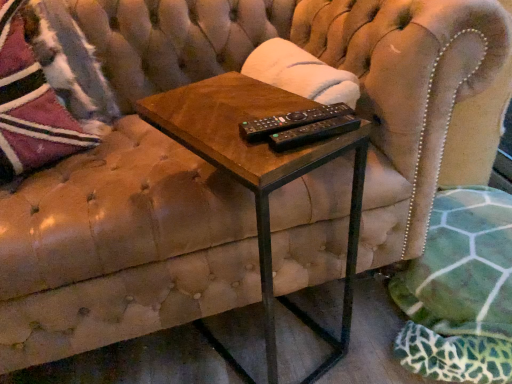
Question: Is black plastic remote controls at center in front of or behind black plastic remote at center in the image?

Choices:
 (A) front
 (B) behind

Answer: (B)

Question: From a real-world perspective, relative to black plastic remote at center, is black plastic remote controls at center vertically above or below?

Choices:
 (A) below
 (B) above

Answer: (A)

Question: Which is nearer to the black plastic remote at center?

Choices:
 (A) green fabric swivel chair at lower right
 (B) black plastic remote controls at center
 (C) velvet textured throw pillow at upper left
 (D) woodenmaterial/texturetable at center

Answer: (B)

Question: Which object is positioned farthest from the velvet textured throw pillow at upper left?

Choices:
 (A) black plastic remote controls at center
 (B) green fabric swivel chair at lower right
 (C) black plastic remote at center
 (D) woodenmaterial/texturetable at center

Answer: (B)